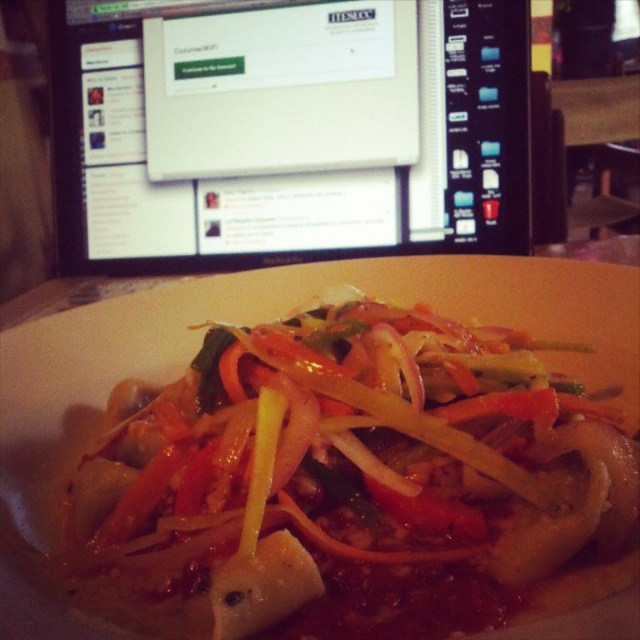
Consider the image. Does slightly translucent pasta at center have a larger size compared to black glossy monitor at upper center?

No.

Is slightly translucent pasta at center further to the viewer compared to black glossy monitor at upper center?

No, slightly translucent pasta at center is in front of black glossy monitor at upper center.

Find the location of a particular element. This screenshot has height=640, width=640. slightly translucent pasta at center is located at coordinates (346, 483).

The image size is (640, 640). In order to click on slightly translucent pasta at center in this screenshot , I will do `click(346, 483)`.